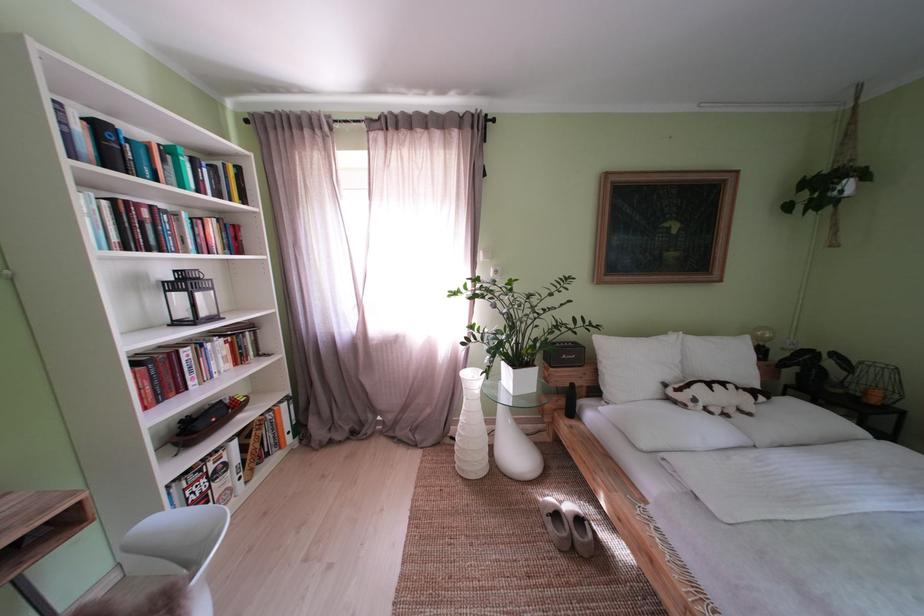
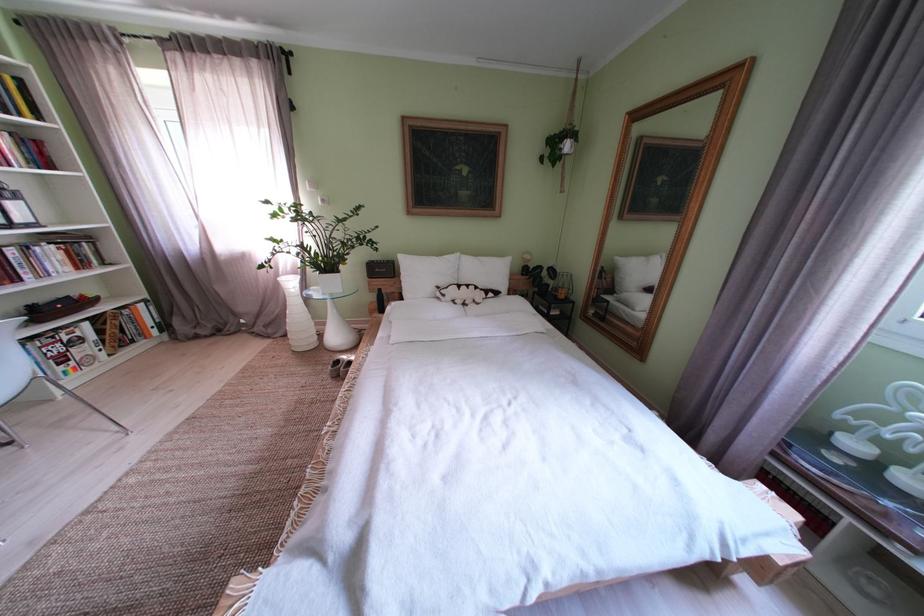
Find the pixel in the second image that matches (639,369) in the first image.

(429, 280)